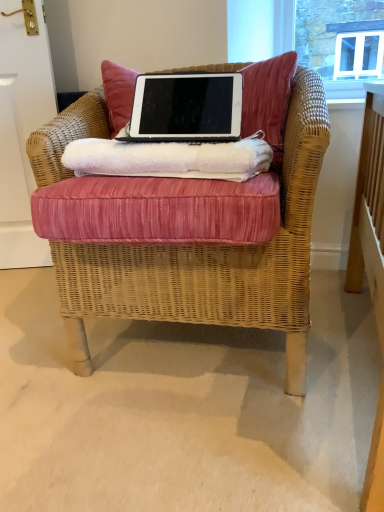
In order to face pink fabric cushion at center, should I rotate leftwards or rightwards?

Turn left by 1.530 degrees to look at pink fabric cushion at center.

This screenshot has width=384, height=512. Describe the element at coordinates (187, 228) in the screenshot. I see `woven wicker chair at center` at that location.

Identify the location of black matte laptop at center. The image size is (384, 512). (186, 108).

Locate an element on the screen. pink fabric cushion at center is located at coordinates (158, 210).

From a real-world perspective, does woven wicker chair at center stand above white fluffy towel at center?

No, from a real-world perspective, woven wicker chair at center is not on top of white fluffy towel at center.

From the picture: Is woven wicker chair at center next to white fluffy towel at center?

No, woven wicker chair at center is not making contact with white fluffy towel at center.

At what (x,y) coordinates should I click in order to perform the action: click on chair in front of the white fluffy towel at center. Please return your answer as a coordinate pair (x, y). The height and width of the screenshot is (512, 384). Looking at the image, I should click on (187, 228).

Based on the photo, considering the relative sizes of woven wicker chair at center and white fluffy towel at center in the image provided, is woven wicker chair at center bigger than white fluffy towel at center?

Indeed, woven wicker chair at center has a larger size compared to white fluffy towel at center.

From a real-world perspective, between white fluffy towel at center and woven wicker chair at center, who is vertically lower?

In real-world perspective, woven wicker chair at center is lower.

How different are the orientations of white fluffy towel at center and woven wicker chair at center in degrees?

white fluffy towel at center and woven wicker chair at center are facing 5.04 degrees away from each other.

Is the position of white fluffy towel at center less distant than that of woven wicker chair at center?

No, white fluffy towel at center is further to the viewer.

Consider the image. From the image's perspective, which object appears higher, white fluffy towel at center or woven wicker chair at center?

white fluffy towel at center is shown above in the image.

Is black matte laptop at center aimed at woven wicker chair at center?

Yes, black matte laptop at center faces towards woven wicker chair at center.

Considering the points (173, 83) and (302, 104), which point is behind, point (173, 83) or point (302, 104)?

The point (173, 83) is farther.

Does black matte laptop at center have a greater height compared to woven wicker chair at center?

Incorrect, the height of black matte laptop at center is not larger of that of woven wicker chair at center.

Can velvet cushion at upper center be found inside pink fabric cushion at center?

No, velvet cushion at upper center is located outside of pink fabric cushion at center.

From the image's perspective, which is below, pink fabric cushion at center or velvet cushion at upper center?

pink fabric cushion at center appears lower in the image.

From a real-world perspective, which is physically above, pink fabric cushion at center or velvet cushion at upper center?

velvet cushion at upper center.

Between pink fabric cushion at center and velvet cushion at upper center, which one appears on the left side from the viewer's perspective?

Positioned to the left is pink fabric cushion at center.

Is pink fabric cushion at center turned away from white fluffy towel at center?

That's not correct — pink fabric cushion at center is not looking away from white fluffy towel at center.

Between point (153, 219) and point (211, 164), which one is positioned behind?

Positioned behind is point (211, 164).

From a real-world perspective, is pink fabric cushion at center located higher than white fluffy towel at center?

Incorrect, from a real-world perspective, pink fabric cushion at center is lower than white fluffy towel at center.

Can you see pink fabric cushion at center touching white fluffy towel at center?

Yes, pink fabric cushion at center is right next to white fluffy towel at center and making contact.

Which is correct: velvet cushion at upper center is inside black matte laptop at center, or outside of it?

velvet cushion at upper center lies outside black matte laptop at center.

Is velvet cushion at upper center thinner than black matte laptop at center?

In fact, velvet cushion at upper center might be wider than black matte laptop at center.

Is point (115, 111) closer or farther from the camera than point (240, 112)?

Clearly, point (115, 111) is more distant from the camera than point (240, 112).

You are a GUI agent. You are given a task and a screenshot of the screen. Output one action in this format:
    pyautogui.click(x=<x>, y=<y>)
    Task: Click on the laptop in front of the velvet cushion at upper center
    This screenshot has height=512, width=384.
    Given the screenshot: What is the action you would take?
    pyautogui.click(x=186, y=108)

Measure the distance from black matte laptop at center to white fluffy towel at center.

black matte laptop at center and white fluffy towel at center are 4.10 inches apart.

From the image's perspective, between black matte laptop at center and white fluffy towel at center, which one is located above?

black matte laptop at center appears higher in the image.

The width and height of the screenshot is (384, 512). Find the location of `laptop behind the white fluffy towel at center`. laptop behind the white fluffy towel at center is located at coordinates (186, 108).

Is white fluffy towel at center at the back of black matte laptop at center?

black matte laptop at center does not have its back to white fluffy towel at center.

You are a GUI agent. You are given a task and a screenshot of the screen. Output one action in this format:
    pyautogui.click(x=<x>, y=<y>)
    Task: Click on the chair on the right of white fluffy towel at center
    
    Given the screenshot: What is the action you would take?
    click(187, 228)

Find the location of a particular element. chair that is below the white fluffy towel at center (from the image's perspective) is located at coordinates (187, 228).

Looking at the image, which one is located closer to pink fabric cushion at center, black matte laptop at center or velvet cushion at upper center?

The object closer to pink fabric cushion at center is black matte laptop at center.

Considering their positions, is white fluffy towel at center positioned further to black matte laptop at center than pink fabric cushion at center?

pink fabric cushion at center.

Considering their positions, is velvet cushion at upper center positioned closer to woven wicker chair at center than pink fabric cushion at center?

The object closer to woven wicker chair at center is pink fabric cushion at center.

In the scene shown: Estimate the real-world distances between objects in this image. Which object is further from white fluffy towel at center, velvet cushion at upper center or woven wicker chair at center?

Among the two, velvet cushion at upper center is located further to white fluffy towel at center.

Looking at the image, which one is located closer to velvet cushion at upper center, woven wicker chair at center or white fluffy towel at center?

white fluffy towel at center lies closer to velvet cushion at upper center than the other object.

Based on their spatial positions, is woven wicker chair at center or pink fabric cushion at center closer to black matte laptop at center?

Based on the image, pink fabric cushion at center appears to be nearer to black matte laptop at center.

Looking at the image, which one is located further to black matte laptop at center, woven wicker chair at center or white fluffy towel at center?

The object further to black matte laptop at center is woven wicker chair at center.

Which object lies further to the anchor point woven wicker chair at center, white fluffy towel at center or black matte laptop at center?

black matte laptop at center.

At what (x,y) coordinates should I click in order to perform the action: click on bed frame between woven wicker chair at center and white fluffy towel at center along the z-axis. Please return your answer as a coordinate pair (x, y). Looking at the image, I should click on [158, 210].

Where is `bed frame between woven wicker chair at center and velvet cushion at upper center from front to back`? Image resolution: width=384 pixels, height=512 pixels. bed frame between woven wicker chair at center and velvet cushion at upper center from front to back is located at coordinates (158, 210).

This screenshot has width=384, height=512. In order to click on material located between woven wicker chair at center and velvet cushion at upper center in the depth direction in this screenshot , I will do `click(169, 159)`.

At what (x,y) coordinates should I click in order to perform the action: click on laptop between woven wicker chair at center and velvet cushion at upper center along the z-axis. Please return your answer as a coordinate pair (x, y). This screenshot has width=384, height=512. Looking at the image, I should click on (186, 108).